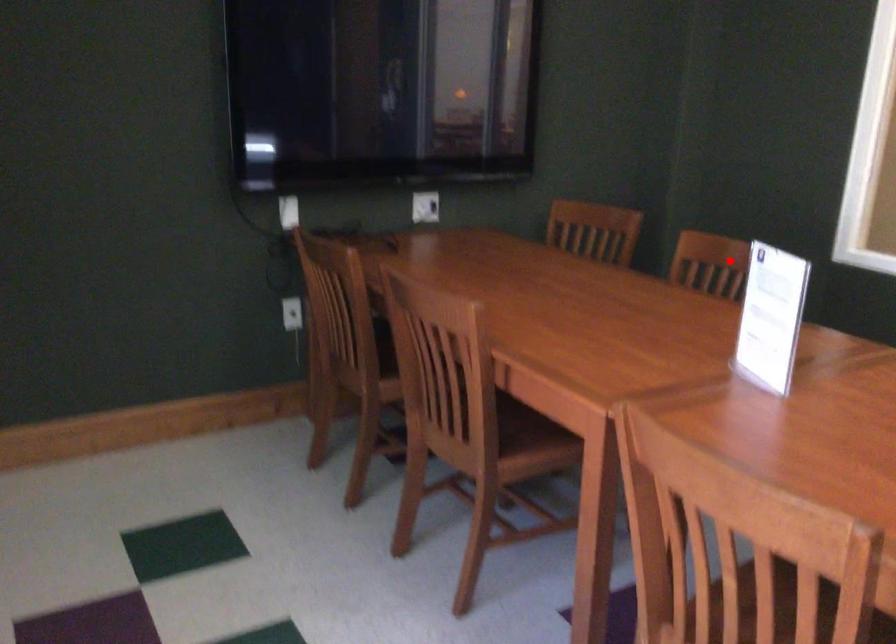
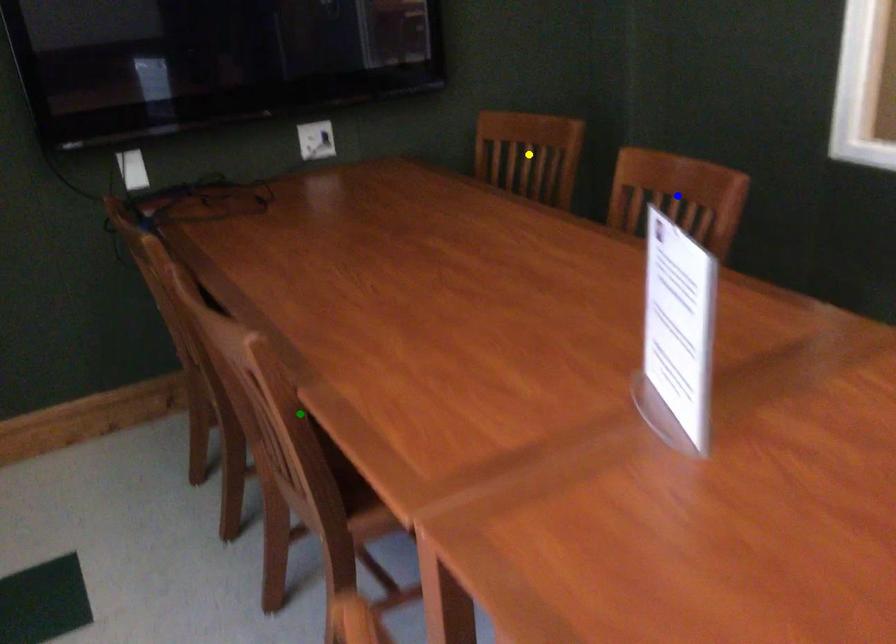
Question: I am providing you with two images of the same scene from different viewpoints. A red point is marked on the first image. You are given multiple points on the second image. Which spot in image 2 lines up with the point in image 1?

Choices:
 (A) blue point
 (B) yellow point
 (C) green point

Answer: (A)